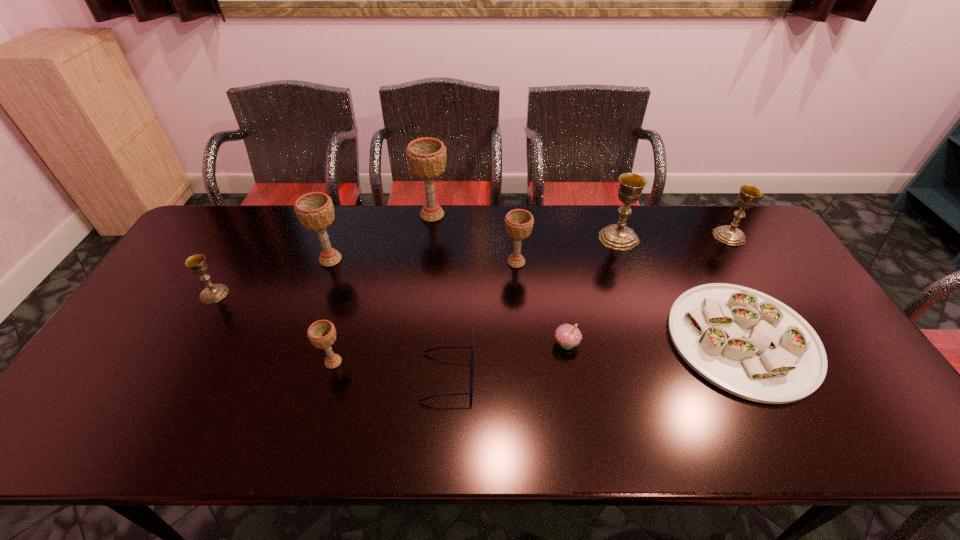
Find the location of a particular element. The image size is (960, 540). chalice that is the closest to the rightmost beige chalice is located at coordinates (426, 157).

Locate which chalice is the seventh closest to the cupcake. Please provide its 2D coordinates. Your answer should be formatted as a tuple, i.e. [(x, y)], where the tuple contains the x and y coordinates of a point satisfying the conditions above.

[(213, 293)]

Identify which beige chalice is the third closest to the third chalice from left to right. Please provide its 2D coordinates. Your answer should be formatted as a tuple, i.e. [(x, y)], where the tuple contains the x and y coordinates of a point satisfying the conditions above.

[(426, 157)]

Identify which beige chalice is located as the third nearest to the second object from left to right. Please provide its 2D coordinates. Your answer should be formatted as a tuple, i.e. [(x, y)], where the tuple contains the x and y coordinates of a point satisfying the conditions above.

[(518, 223)]

Select which gold chalice is the second closest to the leftmost gold chalice. Please provide its 2D coordinates. Your answer should be formatted as a tuple, i.e. [(x, y)], where the tuple contains the x and y coordinates of a point satisfying the conditions above.

[(730, 235)]

Select which gold chalice is the second closest to the farthest beige chalice. Please provide its 2D coordinates. Your answer should be formatted as a tuple, i.e. [(x, y)], where the tuple contains the x and y coordinates of a point satisfying the conditions above.

[(213, 293)]

This screenshot has height=540, width=960. I want to click on vacant space that satisfies the following two spatial constraints: 1. on the front side of the third biggest beige chalice; 2. on the front-facing side of the spectacles, so [x=526, y=377].